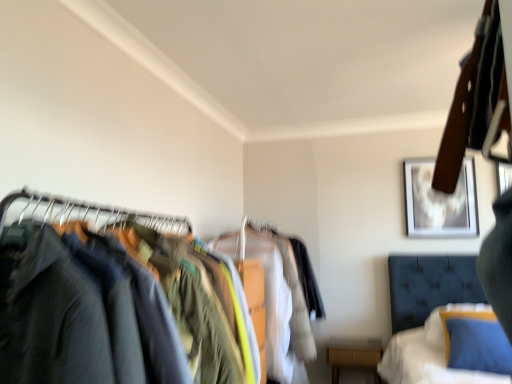
Question: Would you say velvet blue bed at lower right is to the left or to the right of white cotton shirt at center, the first clothing when ordered from back to front, in the picture?

Choices:
 (A) right
 (B) left

Answer: (A)

Question: Is velvet blue bed at lower right situated inside white cotton shirt at center, acting as the 2th clothing starting from the front, or outside?

Choices:
 (A) inside
 (B) outside

Answer: (B)

Question: Estimate the real-world distances between objects in this image. Which object is closer to the metallic silver picture frame at upper right, positioned as the 2th picture frame in left-to-right order?

Choices:
 (A) dark gray fabric at left, which is the second clothing from back to front
 (B) velvet blue bed at lower right
 (C) dark blue fabric at left
 (D) wooden framed artwork at upper right, marked as the 1th picture frame in a left-to-right arrangement
 (E) white cotton shirt at center, the first clothing when ordered from back to front

Answer: (A)

Question: Based on their relative distances, which object is farther from the dark gray fabric at left, which is the 1th clothing in front-to-back order?

Choices:
 (A) dark blue fabric at left
 (B) wooden framed artwork at upper right, marked as the 1th picture frame in a left-to-right arrangement
 (C) velvet blue bed at lower right
 (D) white cotton shirt at center, acting as the 2th clothing starting from the front
 (E) metallic silver picture frame at upper right, positioned as the 2th picture frame in left-to-right order

Answer: (B)